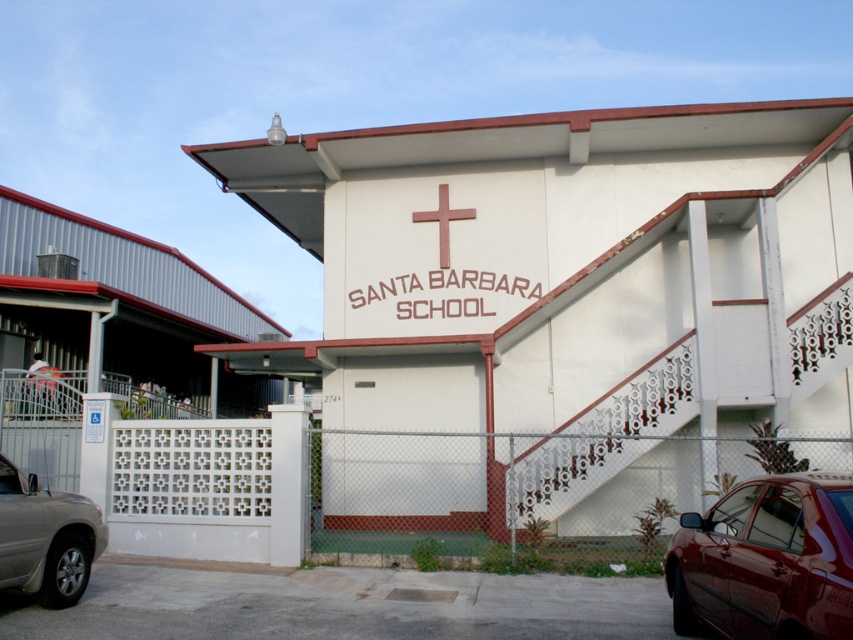
Can you confirm if white matte building at center is smaller than white lattice fence at center?

No, white matte building at center is not smaller than white lattice fence at center.

Looking at this image, between white matte building at center and white lattice fence at center, which one is positioned lower?

white lattice fence at center is lower down.

What do you see at coordinates (561, 310) in the screenshot? The width and height of the screenshot is (853, 640). I see `white matte building at center` at bounding box center [561, 310].

Where is `white matte building at center`? white matte building at center is located at coordinates (561, 310).

Does white matte building at center have a smaller size compared to silver metallic suv at lower left?

Actually, white matte building at center might be larger than silver metallic suv at lower left.

Describe the element at coordinates (561, 310) in the screenshot. The image size is (853, 640). I see `white matte building at center` at that location.

I want to click on white matte building at center, so tap(561, 310).

Based on the photo, does shiny dark red sedan at lower right have a greater height compared to silver metallic suv at lower left?

Correct, shiny dark red sedan at lower right is much taller as silver metallic suv at lower left.

Can you confirm if shiny dark red sedan at lower right is wider than silver metallic suv at lower left?

Correct, the width of shiny dark red sedan at lower right exceeds that of silver metallic suv at lower left.

Identify the location of shiny dark red sedan at lower right. The image size is (853, 640). (767, 560).